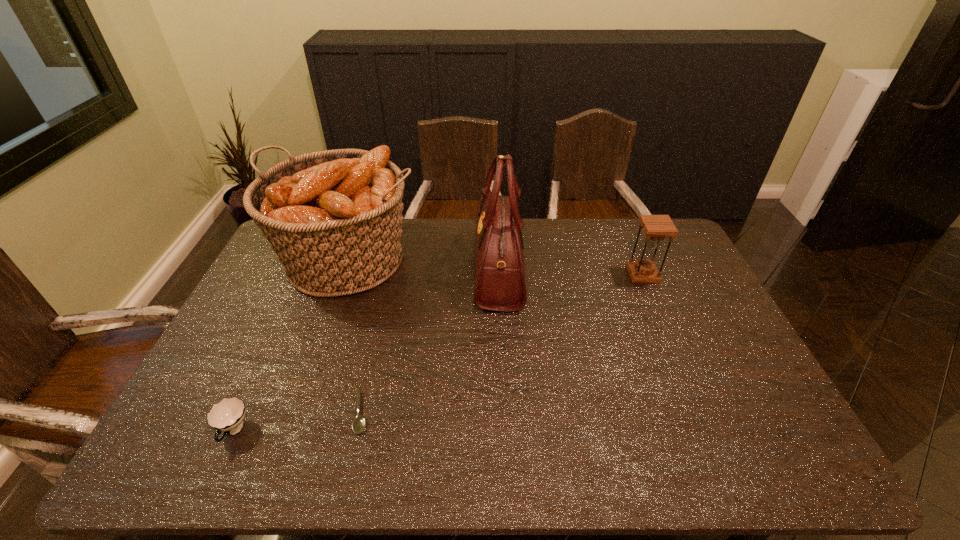
In order to click on free space between the second object from right to left and the basket in this screenshot , I will do `click(423, 264)`.

In order to click on free space between the shortest object and the cup in this screenshot , I will do `click(298, 422)`.

You are a GUI agent. You are given a task and a screenshot of the screen. Output one action in this format:
    pyautogui.click(x=<x>, y=<y>)
    Task: Click on the blank region between the soupspoon and the handbag
    This screenshot has width=960, height=540.
    Given the screenshot: What is the action you would take?
    pyautogui.click(x=430, y=340)

Where is `free space between the handbag and the shortest object`? free space between the handbag and the shortest object is located at coordinates (430, 340).

Select which object appears as the second closest to the cup. Please provide its 2D coordinates. Your answer should be formatted as a tuple, i.e. [(x, y)], where the tuple contains the x and y coordinates of a point satisfying the conditions above.

[(334, 217)]

You are a GUI agent. You are given a task and a screenshot of the screen. Output one action in this format:
    pyautogui.click(x=<x>, y=<y>)
    Task: Click on the object that is the closest to the soupspoon
    The image size is (960, 540).
    Given the screenshot: What is the action you would take?
    pyautogui.click(x=227, y=416)

Locate an element on the screen. The width and height of the screenshot is (960, 540). vacant point that satisfies the following two spatial constraints: 1. on the front-facing side of the handbag; 2. on the back side of the rightmost object is located at coordinates (499, 275).

Where is `free space in the image that satisfies the following two spatial constraints: 1. on the front side of the third shortest object; 2. on the left side of the basket`? free space in the image that satisfies the following two spatial constraints: 1. on the front side of the third shortest object; 2. on the left side of the basket is located at coordinates tap(344, 275).

Where is `vacant space that satisfies the following two spatial constraints: 1. on the front-facing side of the third tallest object; 2. on the right side of the fourth object from left to right`? Image resolution: width=960 pixels, height=540 pixels. vacant space that satisfies the following two spatial constraints: 1. on the front-facing side of the third tallest object; 2. on the right side of the fourth object from left to right is located at coordinates (499, 275).

The image size is (960, 540). Find the location of `vacant area that satisfies the following two spatial constraints: 1. on the front-facing side of the fourth object from left to right; 2. on the side of the cup with the handle`. vacant area that satisfies the following two spatial constraints: 1. on the front-facing side of the fourth object from left to right; 2. on the side of the cup with the handle is located at coordinates (507, 431).